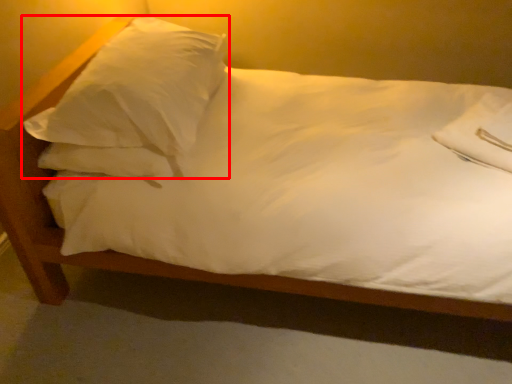
Question: In this image, where is pillow (annotated by the red box) located relative to pillow?

Choices:
 (A) right
 (B) left

Answer: (B)